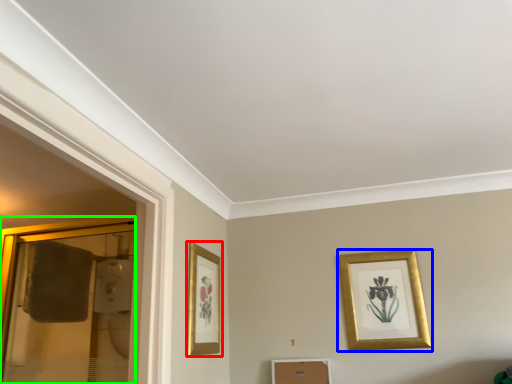
Question: Which is nearer to the picture frame (highlighted by a red box)? picture frame (highlighted by a blue box) or glass door (highlighted by a green box).

Choices:
 (A) picture frame
 (B) glass door

Answer: (A)